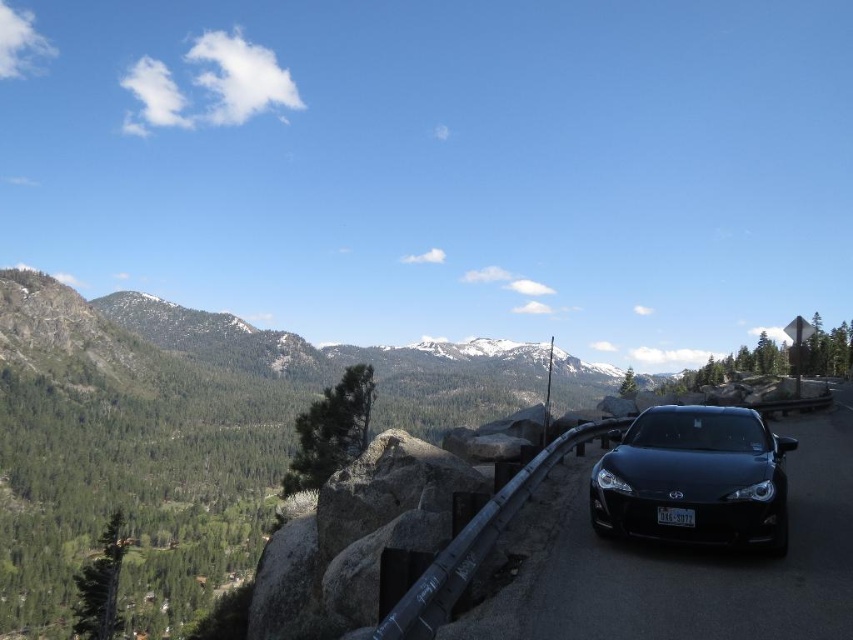
Question: Is glossy black car at center smaller than white plastic license plate at center?

Choices:
 (A) no
 (B) yes

Answer: (A)

Question: Is matte black car at center to the right of white plastic license plate at center from the viewer's perspective?

Choices:
 (A) yes
 (B) no

Answer: (A)

Question: Is glossy black car at center thinner than white plastic license plate at center?

Choices:
 (A) no
 (B) yes

Answer: (A)

Question: Among these objects, which one is nearest to the camera?

Choices:
 (A) matte black car at center
 (B) glossy black car at center

Answer: (B)

Question: Which of the following is the closest to the observer?

Choices:
 (A) white plastic license plate at center
 (B) matte black car at center

Answer: (B)

Question: Which point is closer to the camera?

Choices:
 (A) white plastic license plate at center
 (B) glossy black car at center

Answer: (B)